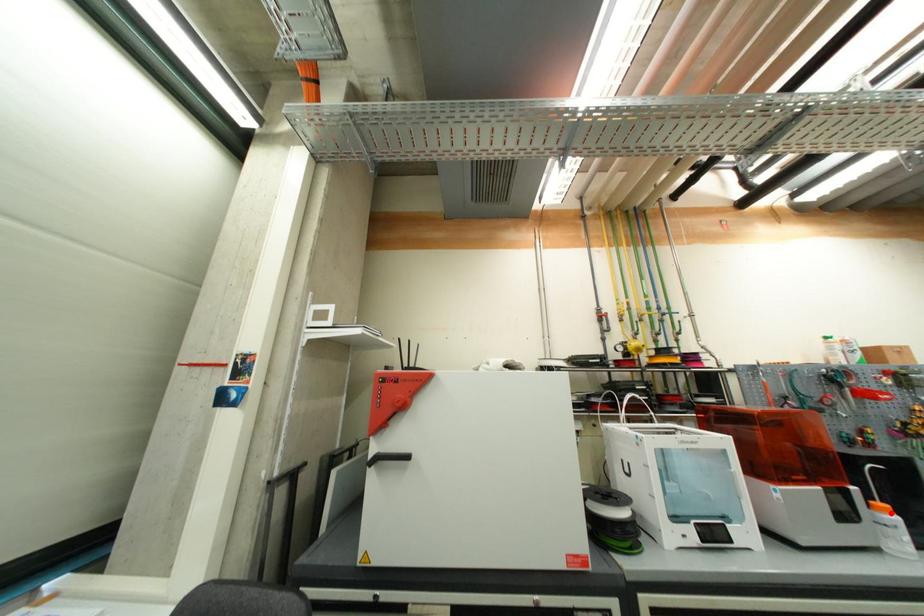
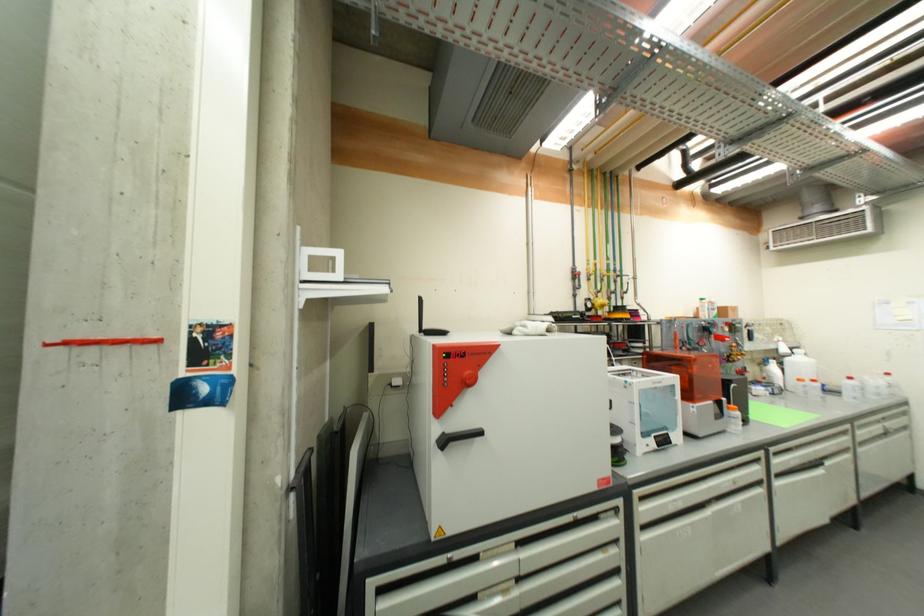
Question: I am providing you with two images of the same scene from different viewpoints. Image1 has a red point marked. In image2, the corresponding 3D location appears at what relative position? Reply with the corresponding letter.

Choices:
 (A) Closer
 (B) Farther

Answer: (B)